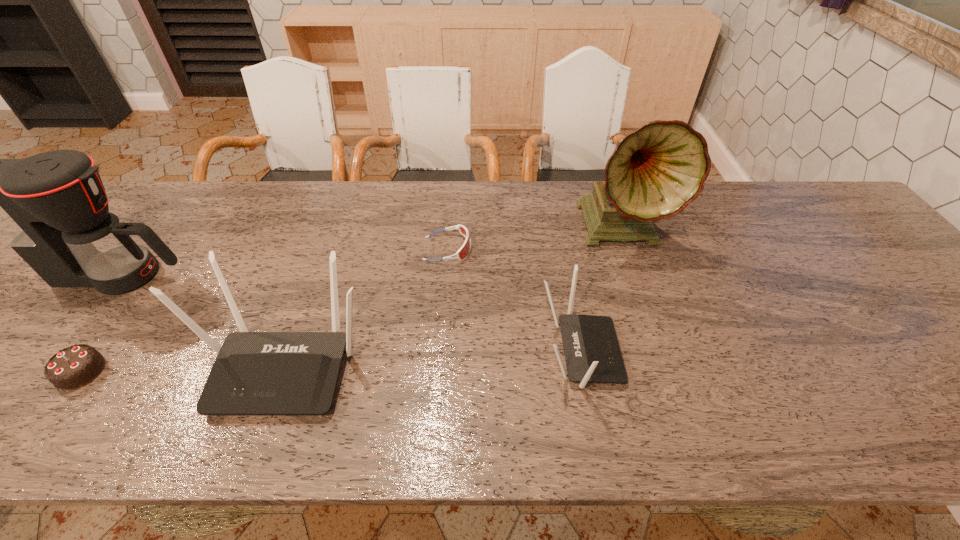
The image size is (960, 540). I want to click on the fourth shortest object, so click(255, 373).

Locate an element on the screen. The image size is (960, 540). the taller router is located at coordinates (255, 373).

Locate an element on the screen. This screenshot has width=960, height=540. the right router is located at coordinates coord(592,353).

The height and width of the screenshot is (540, 960). I want to click on the shorter router, so click(x=592, y=353).

Locate an element on the screen. The height and width of the screenshot is (540, 960). coffee maker is located at coordinates (51, 208).

Image resolution: width=960 pixels, height=540 pixels. I want to click on record player, so click(x=655, y=172).

The image size is (960, 540). What are the coordinates of `goggles` in the screenshot? It's located at (465, 248).

I want to click on the shortest object, so click(x=465, y=248).

The image size is (960, 540). In order to click on chocolate cake in this screenshot , I will do `click(73, 367)`.

Locate an element on the screen. This screenshot has width=960, height=540. vacant space located 0.350m on the front-facing side of the shorter router is located at coordinates (777, 352).